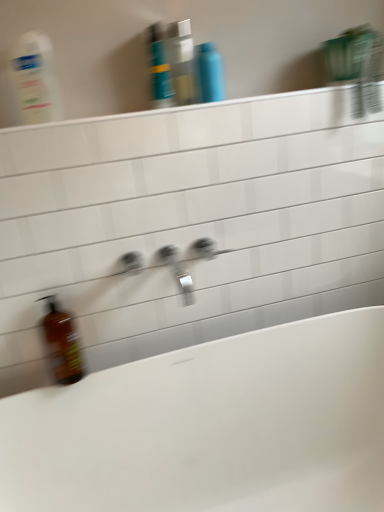
Question: Is translucent plastic bottle at upper left bigger or smaller than silver metallic tap at center?

Choices:
 (A) big
 (B) small

Answer: (B)

Question: From a real-world perspective, is translucent plastic bottle at upper left positioned above or below silver metallic tap at center?

Choices:
 (A) below
 (B) above

Answer: (B)

Question: Which is nearer to the white glossy bathtub at lower left?

Choices:
 (A) blue glossy bottle at upper center, which is the first mouthwash from right to left
 (B) translucent plastic bottle at upper left
 (C) brown glass bottle at lower left
 (D) translucent plastic mouthwash at upper center, the first mouthwash viewed from the left
 (E) silver metallic tap at center

Answer: (C)

Question: Which object is the closest to the brown glass bottle at lower left?

Choices:
 (A) silver metallic tap at center
 (B) white glossy ledge at upper center
 (C) white glossy bathtub at lower left
 (D) translucent plastic mouthwash at upper center, the first mouthwash viewed from the left
 (E) blue glossy shampoo bottle at upper center

Answer: (A)